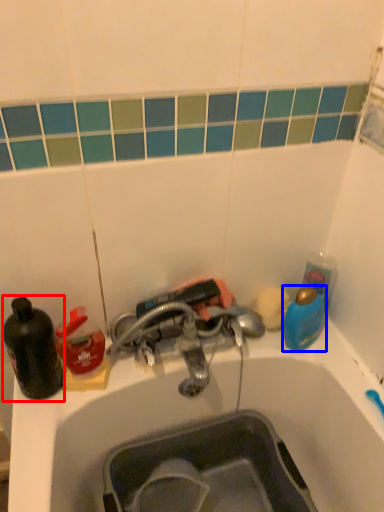
Question: Among these objects, which one is nearest to the camera, bottle (highlighted by a red box) or teal (highlighted by a blue box)?

Choices:
 (A) bottle
 (B) teal

Answer: (A)